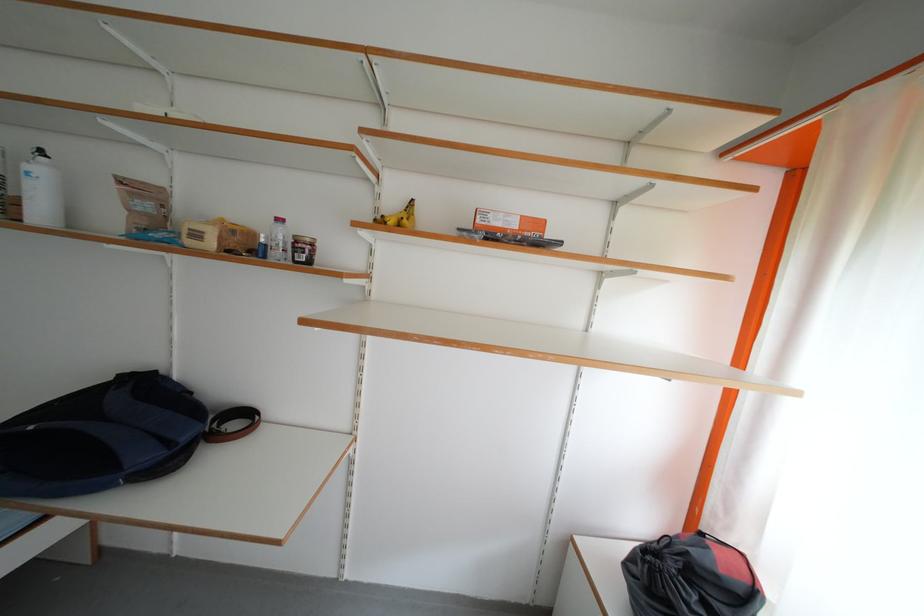
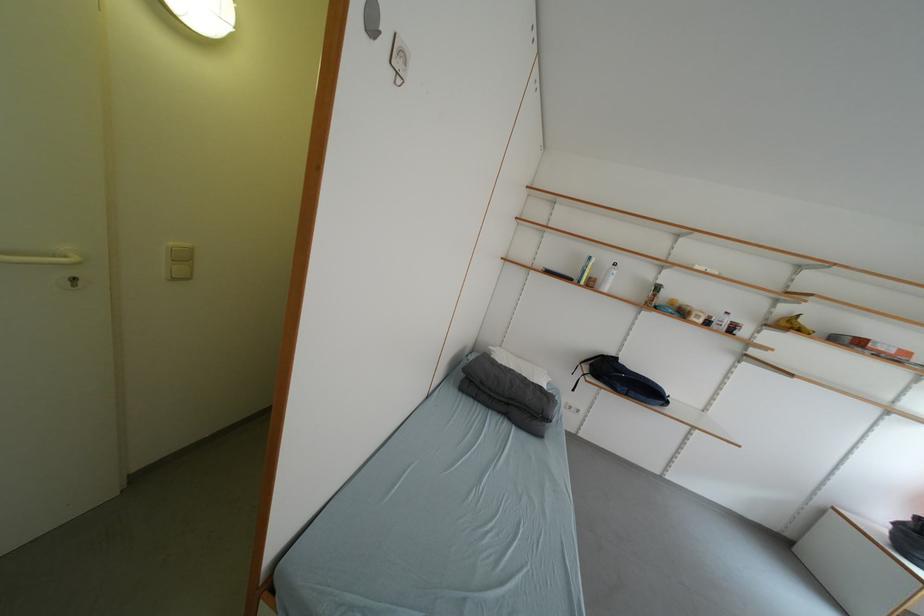
The images are taken continuously from a first-person perspective. In which direction are you moving?

The cameraman walked toward left, backward.